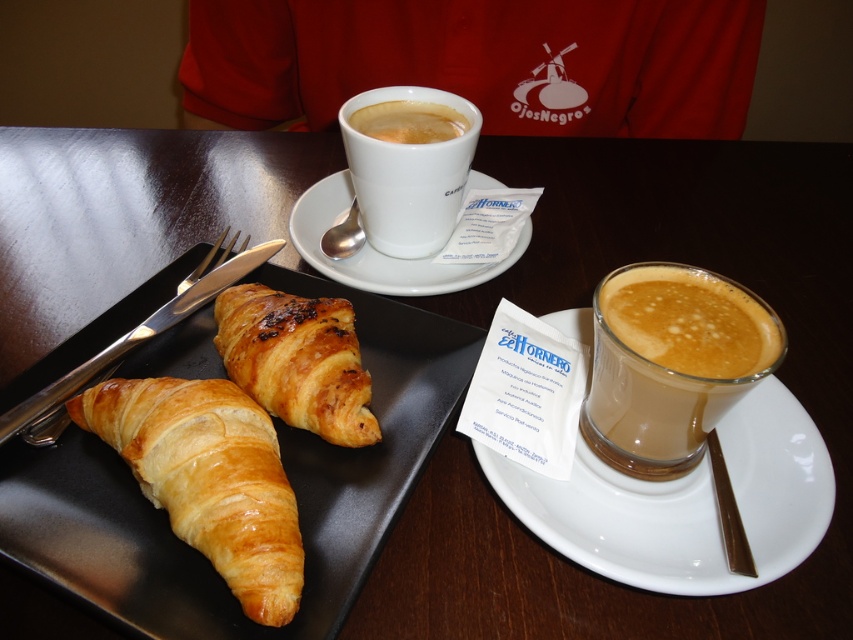
Question: Does white ceramic saucer at right appear over translucent glass cup at center?

Choices:
 (A) no
 (B) yes

Answer: (A)

Question: Can you confirm if translucent glass cup at center is wider than golden brown flaky croissant at center?

Choices:
 (A) no
 (B) yes

Answer: (A)

Question: Among these objects, which one is farthest from the camera?

Choices:
 (A) golden brown flaky croissant at center
 (B) cappuccino foam at upper center
 (C) golden brown flaky croissant at lower left
 (D) translucent glass cup at center

Answer: (B)

Question: Is white ceramic saucer at upper center above silver metallic spoon at upper center?

Choices:
 (A) yes
 (B) no

Answer: (A)

Question: Which point is closer to the camera taking this photo?

Choices:
 (A) (813, 532)
 (B) (368, 227)
 (C) (409, 134)

Answer: (A)

Question: Which of the following is the farthest from the observer?

Choices:
 (A) white ceramic cup at center
 (B) white ceramic saucer at upper center
 (C) cappuccino foam at upper center
 (D) golden brown flaky croissant at center

Answer: (C)